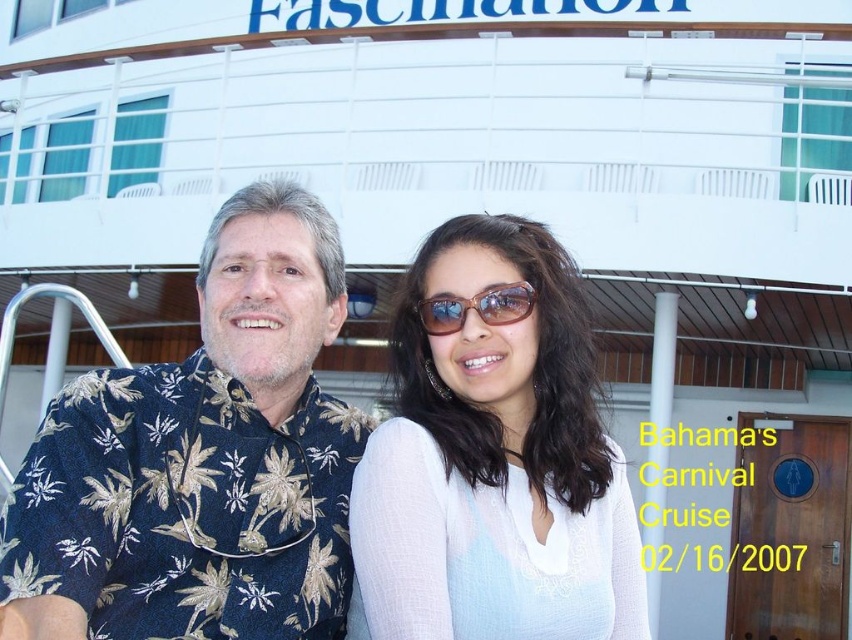
Question: Which object is farther from the camera taking this photo?

Choices:
 (A) blue floral shirt at center
 (B) sunglasses at center

Answer: (B)

Question: Which point is closer to the camera?

Choices:
 (A) sunglasses at center
 (B) blue floral shirt at center
 (C) white matte sunglasses at center

Answer: (B)

Question: Can you confirm if blue floral shirt at center is thinner than sunglasses at center?

Choices:
 (A) yes
 (B) no

Answer: (A)

Question: Which of the following is the closest to the observer?

Choices:
 (A) blue floral shirt at center
 (B) white matte sunglasses at center
 (C) sunglasses at center

Answer: (A)

Question: Does blue floral shirt at center appear under sunglasses at center?

Choices:
 (A) no
 (B) yes

Answer: (B)

Question: Is white matte sunglasses at center to the right of sunglasses at center from the viewer's perspective?

Choices:
 (A) no
 (B) yes

Answer: (B)